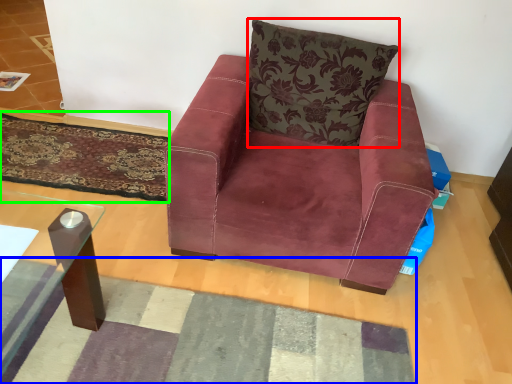
Question: Which object is positioned closest to pillow (highlighted by a red box)? Select from mat (highlighted by a blue box) and mat (highlighted by a green box).

Choices:
 (A) mat
 (B) mat

Answer: (B)